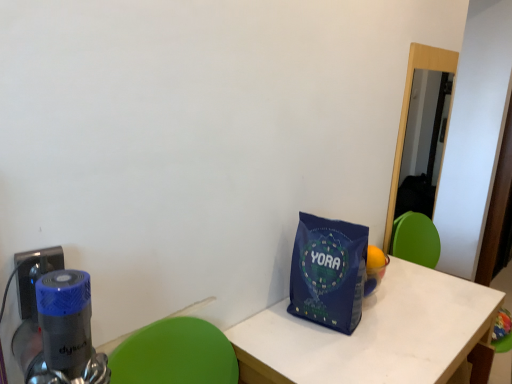
Locate an element on the screen. vacant area on top of white matte table at center (from a real-world perspective) is located at coordinates (387, 321).